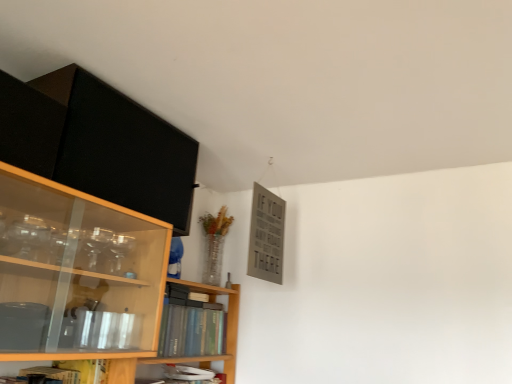
Locate an element on the screen. This screenshot has width=512, height=384. hardcover book at lower center, which is counted as the 1th book, starting from the bottom is located at coordinates (187, 373).

The height and width of the screenshot is (384, 512). What do you see at coordinates (191, 329) in the screenshot?
I see `hardcover book at center, the first book when ordered from top to bottom` at bounding box center [191, 329].

The height and width of the screenshot is (384, 512). I want to click on hardcover book at lower center, which is counted as the 1th book, starting from the bottom, so click(187, 373).

From a real-world perspective, is hardcover book at center, which is the second book from bottom to top, on top of hardcover book at lower center, placed as the 2th book when sorted from top to bottom?

Yes, from a real-world perspective, hardcover book at center, which is the second book from bottom to top, is over hardcover book at lower center, placed as the 2th book when sorted from top to bottom

Is hardcover book at center, the first book when ordered from top to bottom, next to hardcover book at lower center, placed as the 2th book when sorted from top to bottom?

No.

Which of these two, hardcover book at center, which is the second book from bottom to top, or hardcover book at lower center, which is counted as the 1th book, starting from the bottom, is thinner?

Thinner between the two is hardcover book at lower center, which is counted as the 1th book, starting from the bottom.

Looking at this image, is hardcover book at center, which is the second book from bottom to top, surrounding hardcover book at lower center, which is counted as the 1th book, starting from the bottom?

That's incorrect, hardcover book at lower center, which is counted as the 1th book, starting from the bottom, is not inside hardcover book at center, which is the second book from bottom to top.

How distant is hardcover book at center, the first book when ordered from top to bottom, from matte black cabinet at upper left?

hardcover book at center, the first book when ordered from top to bottom, is 67.91 centimeters away from matte black cabinet at upper left.

From the image's perspective, which one is positioned higher, hardcover book at center, the first book when ordered from top to bottom, or matte black cabinet at upper left?

From the image's view, matte black cabinet at upper left is above.

Is matte black cabinet at upper left completely or partially inside hardcover book at center, which is the second book from bottom to top?

No, matte black cabinet at upper left is not surrounded by hardcover book at center, which is the second book from bottom to top.

Which of these two, matte black cabinet at upper left or hardcover book at center, the first book when ordered from top to bottom, is wider?

matte black cabinet at upper left is wider.

Does point (136, 158) appear closer or farther from the camera than point (184, 335)?

Point (136, 158) appears to be closer to the viewer than point (184, 335).

This screenshot has height=384, width=512. There is a matte black cabinet at upper left. Identify the location of the 1st book below it (from the image's perspective). (191, 329).

Could you tell me if matte black cabinet at upper left is turned towards hardcover book at center, the first book when ordered from top to bottom?

No, matte black cabinet at upper left is not turned towards hardcover book at center, the first book when ordered from top to bottom.

Which book is the 2nd one when counting from the back of the matte black cabinet at upper left? Please provide its 2D coordinates.

[(187, 373)]

Is hardcover book at lower center, which is counted as the 1th book, starting from the bottom, surrounding matte black cabinet at upper left?

No.

Which of these two, hardcover book at lower center, placed as the 2th book when sorted from top to bottom, or matte black cabinet at upper left, is thinner?

hardcover book at lower center, placed as the 2th book when sorted from top to bottom, is thinner.

From a real-world perspective, relative to matte black cabinet at upper left, is hardcover book at lower center, placed as the 2th book when sorted from top to bottom, vertically above or below?

hardcover book at lower center, placed as the 2th book when sorted from top to bottom, is below matte black cabinet at upper left.

How distant is hardcover book at lower center, placed as the 2th book when sorted from top to bottom, from hardcover book at center, the first book when ordered from top to bottom?

8.16 inches.

Is hardcover book at lower center, which is counted as the 1th book, starting from the bottom, oriented towards hardcover book at center, which is the second book from bottom to top?

No, hardcover book at lower center, which is counted as the 1th book, starting from the bottom, is not oriented towards hardcover book at center, which is the second book from bottom to top.

Consider the image. Considering the sizes of hardcover book at lower center, which is counted as the 1th book, starting from the bottom, and hardcover book at center, which is the second book from bottom to top, in the image, is hardcover book at lower center, which is counted as the 1th book, starting from the bottom, bigger or smaller than hardcover book at center, which is the second book from bottom to top,?

Considering their sizes, hardcover book at lower center, which is counted as the 1th book, starting from the bottom, takes up less space than hardcover book at center, which is the second book from bottom to top.

This screenshot has width=512, height=384. Identify the location of book in front of the hardcover book at lower center, placed as the 2th book when sorted from top to bottom. (191, 329).

From the image's perspective, is matte black cabinet at upper left located beneath hardcover book at lower center, placed as the 2th book when sorted from top to bottom?

No.

From a real-world perspective, is matte black cabinet at upper left located beneath hardcover book at lower center, placed as the 2th book when sorted from top to bottom?

No.

Considering the sizes of objects matte black cabinet at upper left and hardcover book at lower center, placed as the 2th book when sorted from top to bottom, in the image provided, who is smaller, matte black cabinet at upper left or hardcover book at lower center, placed as the 2th book when sorted from top to bottom,?

hardcover book at lower center, placed as the 2th book when sorted from top to bottom.

Which is behind, matte black cabinet at upper left or hardcover book at lower center, which is counted as the 1th book, starting from the bottom?

hardcover book at lower center, which is counted as the 1th book, starting from the bottom, is further away from the camera.

Find the location of a particular element. The image size is (512, 384). book above the hardcover book at lower center, which is counted as the 1th book, starting from the bottom (from the image's perspective) is located at coordinates (191, 329).

Which book is the 1st one when counting from the back of the matte black cabinet at upper left? Please provide its 2D coordinates.

[(191, 329)]

Based on their spatial positions, is matte black cabinet at upper left or hardcover book at center, which is the second book from bottom to top, further from hardcover book at lower center, which is counted as the 1th book, starting from the bottom?

matte black cabinet at upper left is further to hardcover book at lower center, which is counted as the 1th book, starting from the bottom.

Consider the image. Considering their positions, is hardcover book at center, the first book when ordered from top to bottom, positioned further to hardcover book at lower center, placed as the 2th book when sorted from top to bottom, than matte black cabinet at upper left?

matte black cabinet at upper left lies further to hardcover book at lower center, placed as the 2th book when sorted from top to bottom, than the other object.

Based on their spatial positions, is matte black cabinet at upper left or hardcover book at lower center, placed as the 2th book when sorted from top to bottom, further from hardcover book at center, the first book when ordered from top to bottom?

Based on the image, matte black cabinet at upper left appears to be further to hardcover book at center, the first book when ordered from top to bottom.

From the image, which object appears to be nearer to matte black cabinet at upper left, hardcover book at center, the first book when ordered from top to bottom, or hardcover book at lower center, placed as the 2th book when sorted from top to bottom?

hardcover book at center, the first book when ordered from top to bottom, lies closer to matte black cabinet at upper left than the other object.

Looking at the image, which one is located further to hardcover book at center, which is the second book from bottom to top, hardcover book at lower center, placed as the 2th book when sorted from top to bottom, or matte black cabinet at upper left?

Based on the image, matte black cabinet at upper left appears to be further to hardcover book at center, which is the second book from bottom to top.

Considering their positions, is hardcover book at lower center, placed as the 2th book when sorted from top to bottom, positioned further to matte black cabinet at upper left than hardcover book at center, the first book when ordered from top to bottom?

Among the two, hardcover book at lower center, placed as the 2th book when sorted from top to bottom, is located further to matte black cabinet at upper left.

Image resolution: width=512 pixels, height=384 pixels. Identify the location of book that lies between matte black cabinet at upper left and hardcover book at lower center, placed as the 2th book when sorted from top to bottom, from top to bottom. (191, 329).